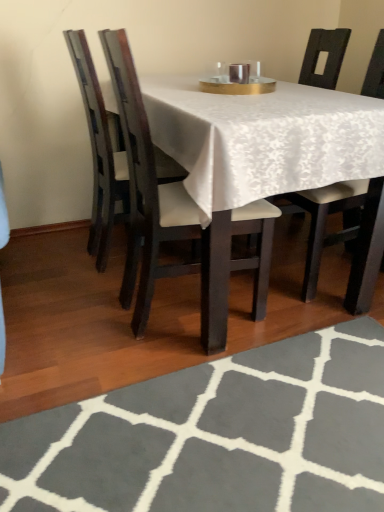
Where is `free space to the left of matte black chair at left, arranged as the first chair when viewed from the left`? free space to the left of matte black chair at left, arranged as the first chair when viewed from the left is located at coordinates (52, 260).